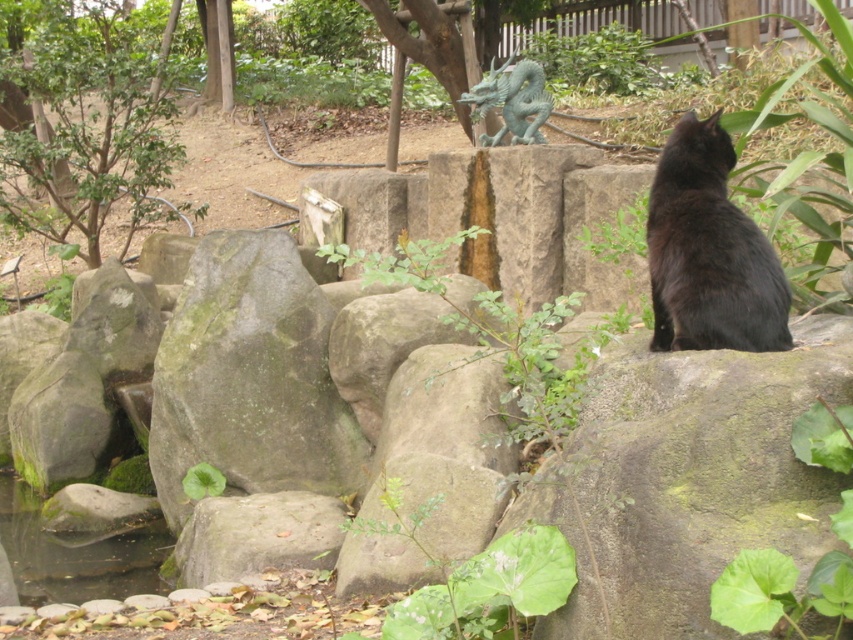
You are an artist planning to paint this scene. You want to ensure the green leafy tree at upper left and the green patina dragon at center are proportionally accurate. Which object should you draw first to maintain scale?

The green leafy tree at upper left should be drawn first since it is larger than the green patina dragon at center, helping establish the correct scale for both objects.

In the scene shown: You are a photographer trying to capture the black fur cat at right and the green leafy tree at upper left in the same frame. Can you see both objects clearly at the same time?

The black fur cat at right is behind the green leafy tree at upper left, so you cannot see both clearly at the same time.

You are standing in the outdoor scene and want to take a photo of the green leafy tree at upper left. If your camera can focus up to 10 meters, will you be able to capture the tree clearly?

The green leafy tree at upper left is 9.74 meters away from the viewer, which is within the camera focus range of up to 10 meters. Therefore, you can capture the tree clearly.